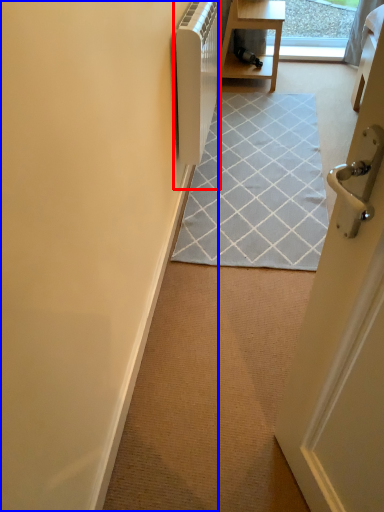
Question: Which object is further to the camera taking this photo, appliance (highlighted by a red box) or door (highlighted by a blue box)?

Choices:
 (A) appliance
 (B) door

Answer: (A)